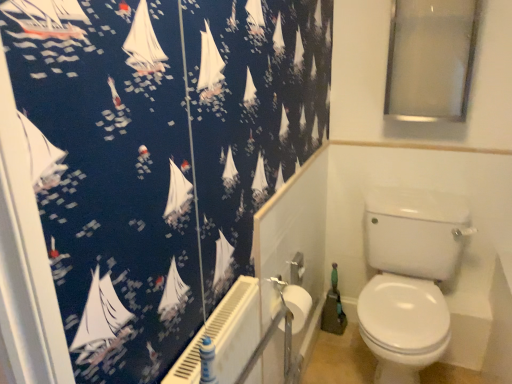
Question: Is there a large distance between transparent glass window screen at upper right and white glossy toilet at lower right?

Choices:
 (A) yes
 (B) no

Answer: (B)

Question: Are transparent glass window screen at upper right and white glossy toilet at lower right beside each other?

Choices:
 (A) no
 (B) yes

Answer: (A)

Question: Does transparent glass window screen at upper right come in front of white glossy toilet at lower right?

Choices:
 (A) no
 (B) yes

Answer: (A)

Question: Can you confirm if transparent glass window screen at upper right is wider than white glossy toilet at lower right?

Choices:
 (A) no
 (B) yes

Answer: (A)

Question: From the image's perspective, is transparent glass window screen at upper right above white glossy toilet at lower right?

Choices:
 (A) yes
 (B) no

Answer: (A)

Question: From a real-world perspective, is transparent glass window screen at upper right positioned over white glossy toilet at lower right based on gravity?

Choices:
 (A) yes
 (B) no

Answer: (A)

Question: Is white plastic radiator at lower center not inside transparent glass window screen at upper right?

Choices:
 (A) no
 (B) yes

Answer: (B)

Question: Is white plastic radiator at lower center oriented away from transparent glass window screen at upper right?

Choices:
 (A) no
 (B) yes

Answer: (A)

Question: From the image's perspective, is white plastic radiator at lower center located above transparent glass window screen at upper right?

Choices:
 (A) yes
 (B) no

Answer: (B)

Question: From a real-world perspective, is white plastic radiator at lower center on transparent glass window screen at upper right?

Choices:
 (A) yes
 (B) no

Answer: (B)

Question: Is the depth of white plastic radiator at lower center greater than that of transparent glass window screen at upper right?

Choices:
 (A) yes
 (B) no

Answer: (B)

Question: Does white plastic radiator at lower center have a larger size compared to transparent glass window screen at upper right?

Choices:
 (A) no
 (B) yes

Answer: (A)

Question: Can you confirm if white glossy toilet at lower right is positioned to the right of white plastic radiator at lower center?

Choices:
 (A) no
 (B) yes

Answer: (B)